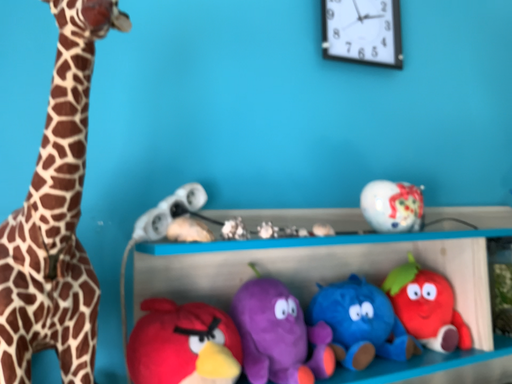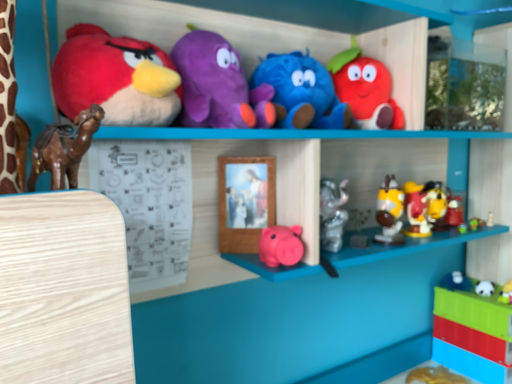
Question: How did the camera likely rotate when shooting the video?

Choices:
 (A) rotated upward
 (B) rotated downward

Answer: (B)